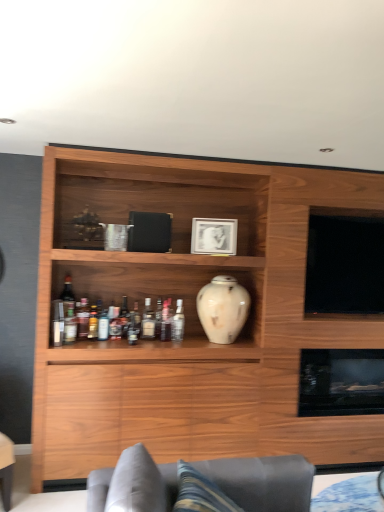
Question: Can you confirm if translucent glass bottle at middle, which appears as the 4th bottle when viewed from the left, is shorter than wooden cabinet at center?

Choices:
 (A) yes
 (B) no

Answer: (A)

Question: From the image's perspective, is translucent glass bottle at middle, which appears as the 4th bottle when viewed from the left, below wooden cabinet at center?

Choices:
 (A) yes
 (B) no

Answer: (A)

Question: Is there a large distance between translucent glass bottle at middle, which appears as the 4th bottle when viewed from the left, and wooden cabinet at center?

Choices:
 (A) yes
 (B) no

Answer: (B)

Question: Does translucent glass bottle at middle, arranged as the 3th bottle when viewed from the right, have a greater width compared to wooden cabinet at center?

Choices:
 (A) no
 (B) yes

Answer: (A)

Question: Is translucent glass bottle at middle, arranged as the 3th bottle when viewed from the right, completely or partially outside of wooden cabinet at center?

Choices:
 (A) no
 (B) yes

Answer: (A)

Question: Is black glossy screen at upper right bigger or smaller than translucent glass bottle at center, which ranks as the second bottle in left-to-right order?

Choices:
 (A) big
 (B) small

Answer: (A)

Question: Considering their positions, is black glossy screen at upper right located in front of or behind translucent glass bottle at center, which appears as the 5th bottle when viewed from the right?

Choices:
 (A) behind
 (B) front

Answer: (B)

Question: From a real-world perspective, relative to translucent glass bottle at center, which ranks as the second bottle in left-to-right order, is black glossy screen at upper right vertically above or below?

Choices:
 (A) above
 (B) below

Answer: (A)

Question: Would you say black glossy screen at upper right is to the left or to the right of translucent glass bottle at center, which ranks as the second bottle in left-to-right order, in the picture?

Choices:
 (A) right
 (B) left

Answer: (A)

Question: Would you say white glossy vase at center is to the left or to the right of white glossy picture frame at upper center in the picture?

Choices:
 (A) left
 (B) right

Answer: (B)

Question: In terms of size, does white glossy vase at center appear bigger or smaller than white glossy picture frame at upper center?

Choices:
 (A) small
 (B) big

Answer: (B)

Question: Is point (233, 282) positioned closer to the camera than point (203, 219)?

Choices:
 (A) farther
 (B) closer

Answer: (B)

Question: Looking at their shapes, would you say white glossy vase at center is wider or thinner than white glossy picture frame at upper center?

Choices:
 (A) thin
 (B) wide

Answer: (B)

Question: In the image, is white glossy vase at center on the left side or the right side of translucent glass bottle at center, which appears as the 5th bottle when viewed from the right?

Choices:
 (A) right
 (B) left

Answer: (A)

Question: Is white glossy vase at center bigger or smaller than translucent glass bottle at center, which appears as the 5th bottle when viewed from the right?

Choices:
 (A) small
 (B) big

Answer: (B)